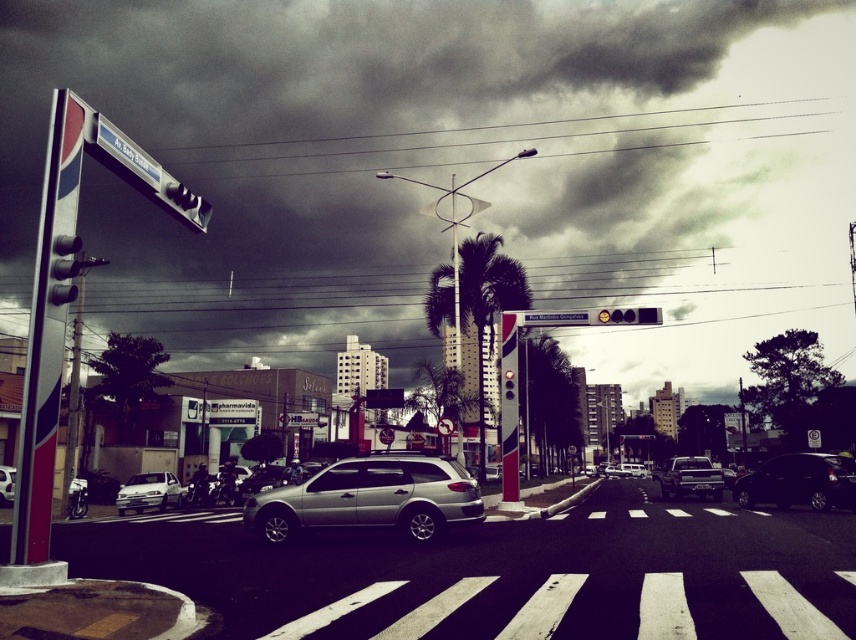
Consider the image. You are a pedestrian standing at the crosswalk. You see a satin silver car at center and a silver metallic suv at center approaching. Which vehicle will you need to wait for longer before it passes?

The silver metallic suv at center is longer than the satin silver car at center, so you will need to wait longer for the silver metallic suv at center to pass completely.

You are standing on the sidewalk looking at the Pepsi traffic light pole. There are two points marked on the road ahead of you. Which point is closer to you, point (265,540) or point (12,497)?

Point (265,540) is closer to you than point (12,497).